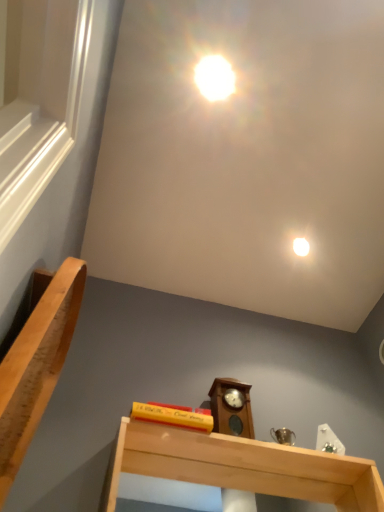
Question: Does light wood shelf at lower center appear on the right side of white glossy droplight at upper center?

Choices:
 (A) yes
 (B) no

Answer: (B)

Question: Does light wood shelf at lower center have a lesser width compared to white glossy droplight at upper center?

Choices:
 (A) no
 (B) yes

Answer: (A)

Question: Is there a large distance between light wood shelf at lower center and white glossy droplight at upper center?

Choices:
 (A) no
 (B) yes

Answer: (A)

Question: From a real-world perspective, does light wood shelf at lower center sit lower than white glossy droplight at upper center?

Choices:
 (A) yes
 (B) no

Answer: (A)

Question: From the image's perspective, is light wood shelf at lower center below white glossy droplight at upper center?

Choices:
 (A) yes
 (B) no

Answer: (A)

Question: Is point (235, 452) positioned closer to the camera than point (248, 396)?

Choices:
 (A) closer
 (B) farther

Answer: (A)

Question: Considering their positions, is light wood shelf at lower center located in front of or behind wooden grandfather clock at center?

Choices:
 (A) front
 (B) behind

Answer: (A)

Question: In terms of size, does light wood shelf at lower center appear bigger or smaller than wooden grandfather clock at center?

Choices:
 (A) small
 (B) big

Answer: (B)

Question: Do you think light wood shelf at lower center is within wooden grandfather clock at center, or outside of it?

Choices:
 (A) inside
 (B) outside

Answer: (B)

Question: Is point (301, 250) positioned closer to the camera than point (246, 400)?

Choices:
 (A) closer
 (B) farther

Answer: (B)

Question: From the image's perspective, is white glossy droplight at upper center located above or below wooden grandfather clock at center?

Choices:
 (A) above
 (B) below

Answer: (A)

Question: In terms of width, does white glossy droplight at upper center look wider or thinner when compared to wooden grandfather clock at center?

Choices:
 (A) wide
 (B) thin

Answer: (B)

Question: Is white glossy droplight at upper center taller or shorter than wooden grandfather clock at center?

Choices:
 (A) tall
 (B) short

Answer: (B)

Question: In the image, is light brown wood handrail at left positioned in front of or behind light wood shelf at lower center?

Choices:
 (A) front
 (B) behind

Answer: (A)

Question: From a real-world perspective, is light brown wood handrail at left physically located above or below light wood shelf at lower center?

Choices:
 (A) above
 (B) below

Answer: (B)